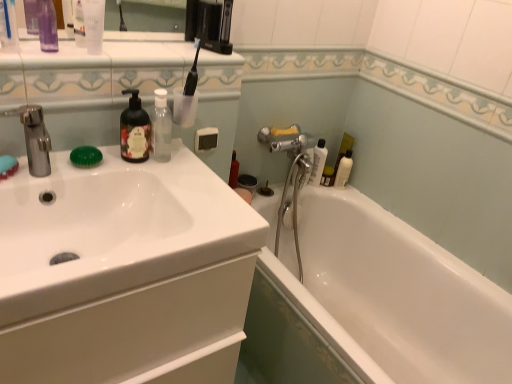
Find the location of a particular element. free location in front of green translucent soap at left is located at coordinates (57, 174).